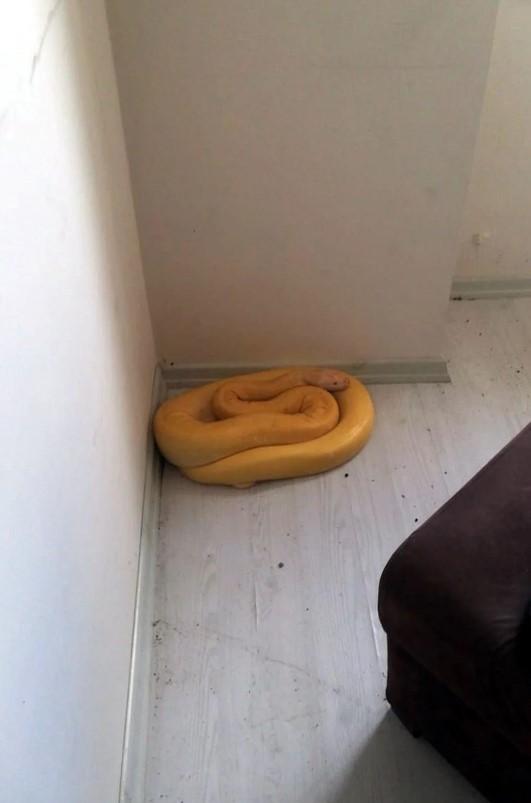
In order to click on floor in this screenshot , I will do `click(323, 597)`.